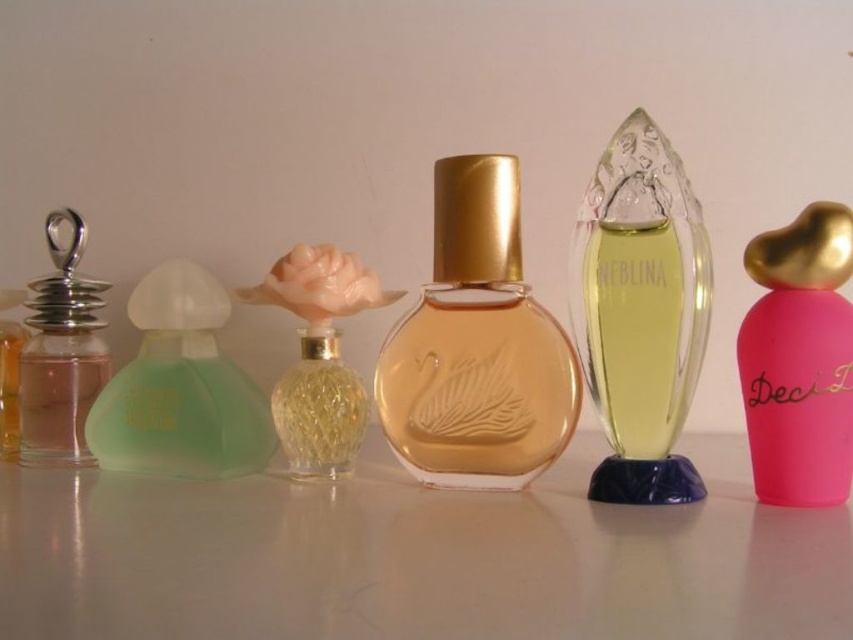
Question: Is pink matte bottle at right wider than translucent yellow glass at center?

Choices:
 (A) no
 (B) yes

Answer: (A)

Question: Which point appears closest to the camera in this image?

Choices:
 (A) (399, 419)
 (B) (0, 308)
 (C) (608, 237)
 (D) (808, 280)

Answer: (D)

Question: Estimate the real-world distances between objects in this image. Which object is closer to the green matte bottle at left?

Choices:
 (A) clear glass perfume at center
 (B) brushed metal perfume at left
 (C) pink matte bottle at right

Answer: (B)

Question: Can you confirm if green frosted glass perfume at center left is positioned to the right of brushed metal perfume at left?

Choices:
 (A) no
 (B) yes

Answer: (B)

Question: Which object is closer to the camera taking this photo?

Choices:
 (A) translucent glass bottle at center
 (B) pink matte bottle at right

Answer: (B)

Question: Considering the relative positions of translucent glass bottle at center and clear glass perfume at center in the image provided, where is translucent glass bottle at center located with respect to clear glass perfume at center?

Choices:
 (A) left
 (B) right

Answer: (A)